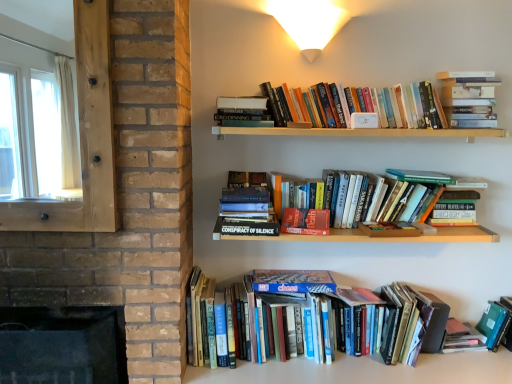
Find the location of a particular element. The image size is (512, 384). hardcover book at center, the third paperback book from the right is located at coordinates (305, 221).

In the scene shown: Measure the distance between green matte folder at lower right, the 1th book when ordered from bottom to top, and camera.

A distance of 6.54 feet exists between green matte folder at lower right, the 1th book when ordered from bottom to top, and camera.

Measure the distance between transparent wooden frame at left and camera.

transparent wooden frame at left and camera are 1.44 meters apart from each other.

Describe the element at coordinates (82, 139) in the screenshot. I see `transparent wooden frame at left` at that location.

What are the coordinates of `dark brick fireplace at lower left` in the screenshot? It's located at (62, 345).

This screenshot has height=384, width=512. In order to click on hardcover book at lower right, placed as the third paperback book when sorted from top to bottom in this screenshot , I will do `click(462, 337)`.

The image size is (512, 384). I want to click on hardcover book at center, which is the 2th paperback book in bottom-to-top order, so click(x=305, y=221).

Is hardcover book at center right, marked as the 1th paperback book in a top-to-bottom arrangement, taller than dark brick fireplace at lower left?

In fact, hardcover book at center right, marked as the 1th paperback book in a top-to-bottom arrangement, may be shorter than dark brick fireplace at lower left.

I want to click on fireplace below the hardcover book at center right, marked as the 1th paperback book in a top-to-bottom arrangement (from the image's perspective), so click(x=62, y=345).

Are hardcover book at center right, which is the 2th paperback book in left-to-right order, and dark brick fireplace at lower left far apart?

Indeed, hardcover book at center right, which is the 2th paperback book in left-to-right order, is not near dark brick fireplace at lower left.

Is point (468, 209) in front of point (70, 307)?

That is True.

Locate an element on the screen. Image resolution: width=512 pixels, height=384 pixels. book that is the 4th object located above the hardcover book at lower right, which ranks as the 3th paperback book in left-to-right order (from the image's perspective) is located at coordinates (243, 112).

Which object is positioned more to the left, hardcover book at lower right, which ranks as the 1th paperback book in right-to-left order, or hardcover book at upper center, positioned as the 2th book in top-to-bottom order?

From the viewer's perspective, hardcover book at upper center, positioned as the 2th book in top-to-bottom order, appears more on the left side.

Which is nearer, (455, 321) or (234, 121)?

The point (234, 121) is more forward.

Is hardcover book at lower right, placed as the third paperback book when sorted from top to bottom, wider than hardcover book at upper center, positioned as the 2th book in top-to-bottom order?

No.

Is hardcover book at upper center, acting as the 4th book starting from the bottom, looking in the opposite direction of hardcover book at center right, which is the 2th paperback book in left-to-right order?

No, hardcover book at center right, which is the 2th paperback book in left-to-right order, is not at the back of hardcover book at upper center, acting as the 4th book starting from the bottom.

From a real-world perspective, is hardcover book at upper center, acting as the 4th book starting from the bottom, over hardcover book at center right, the third paperback book when ordered from bottom to top?

Yes, from a real-world perspective, hardcover book at upper center, acting as the 4th book starting from the bottom, is above hardcover book at center right, the third paperback book when ordered from bottom to top.

Which of these two, hardcover book at upper center, positioned as the 2th book in top-to-bottom order, or hardcover book at center right, the third paperback book when ordered from bottom to top, is bigger?

hardcover book at center right, the third paperback book when ordered from bottom to top.

Can you confirm if hardcover book at center, which is counted as the third book, starting from the top, is bigger than green matte folder at lower right, the 1th book when ordered from bottom to top?

Yes, hardcover book at center, which is counted as the third book, starting from the top, is bigger than green matte folder at lower right, the 1th book when ordered from bottom to top.

From a real-world perspective, between hardcover book at center, which is counted as the third book, starting from the top, and green matte folder at lower right, the 1th book when ordered from bottom to top, who is vertically lower?

green matte folder at lower right, the 1th book when ordered from bottom to top, from a real-world perspective.

Is point (233, 225) positioned in front of point (507, 316)?

That is True.

Is hardcover book at center, which is counted as the third book, starting from the bottom, at the right side of green matte folder at lower right, the 1th book when ordered from bottom to top?

Incorrect, hardcover book at center, which is counted as the third book, starting from the bottom, is not on the right side of green matte folder at lower right, the 1th book when ordered from bottom to top.

How many degrees apart are the facing directions of hardcover book at lower right, which ranks as the 3th paperback book in left-to-right order, and hardcover book at center right, which is the 2th paperback book in left-to-right order?

They differ by 8.31 degrees in their facing directions.

Would you say hardcover book at lower right, which ranks as the 3th paperback book in left-to-right order, is a long distance from hardcover book at center right, the second paperback book when ordered from right to left?

They are positioned close to each other.

Between hardcover book at lower right, which ranks as the 1th paperback book in right-to-left order, and hardcover book at center right, marked as the 1th paperback book in a top-to-bottom arrangement, which one has smaller width?

hardcover book at lower right, which ranks as the 1th paperback book in right-to-left order, is thinner.

Considering the sizes of hardcover book at lower right, which ranks as the 3th paperback book in left-to-right order, and hardcover book at center right, which is the 2th paperback book in left-to-right order, in the image, is hardcover book at lower right, which ranks as the 3th paperback book in left-to-right order, taller or shorter than hardcover book at center right, which is the 2th paperback book in left-to-right order,?

Clearly, hardcover book at lower right, which ranks as the 3th paperback book in left-to-right order, is shorter compared to hardcover book at center right, which is the 2th paperback book in left-to-right order.

Measure the distance from hardcover books at lower center, the fourth book in the top-to-bottom sequence, to dark brick fireplace at lower left.

A distance of 26.15 inches exists between hardcover books at lower center, the fourth book in the top-to-bottom sequence, and dark brick fireplace at lower left.

Starting from the dark brick fireplace at lower left, which book is the 3rd one behind? Please provide its 2D coordinates.

[(310, 322)]

Considering the sizes of objects hardcover books at lower center, the 2th book when ordered from bottom to top, and dark brick fireplace at lower left in the image provided, who is taller, hardcover books at lower center, the 2th book when ordered from bottom to top, or dark brick fireplace at lower left?

dark brick fireplace at lower left.

Is hardcover books at lower center, the fourth book in the top-to-bottom sequence, turned away from dark brick fireplace at lower left?

hardcover books at lower center, the fourth book in the top-to-bottom sequence, is not turned away from dark brick fireplace at lower left.

Can you confirm if transparent wooden frame at left is thinner than hardcover book at center, which is counted as the third book, starting from the top?

Correct, the width of transparent wooden frame at left is less than that of hardcover book at center, which is counted as the third book, starting from the top.

Which of these two, transparent wooden frame at left or hardcover book at center, which is counted as the third book, starting from the bottom, is smaller?

Smaller between the two is hardcover book at center, which is counted as the third book, starting from the bottom.

From a real-world perspective, who is located lower, transparent wooden frame at left or hardcover book at center, which is counted as the third book, starting from the top?

In real-world perspective, hardcover book at center, which is counted as the third book, starting from the top, is lower.

Which is closer to the camera, (15, 211) or (256, 217)?

The point (15, 211) is in front.

The height and width of the screenshot is (384, 512). Find the location of `fireplace below the hardcover book at center right, the second paperback book when ordered from right to left (from a real-world perspective)`. fireplace below the hardcover book at center right, the second paperback book when ordered from right to left (from a real-world perspective) is located at coordinates (62, 345).

Find the location of a particular element. the 4th book above when counting from the hardcover book at lower right, which ranks as the 1th paperback book in right-to-left order (from the image's perspective) is located at coordinates (243, 112).

Considering their positions, is hardcover book at upper center, positioned as the 2th book in top-to-bottom order, positioned further to hardcover book at center right, which is the 2th paperback book in left-to-right order, than hardcover books at lower center, the fourth book in the top-to-bottom sequence?

hardcover book at upper center, positioned as the 2th book in top-to-bottom order.

Based on their spatial positions, is hardcover books at lower center, the 2th book when ordered from bottom to top, or green matte folder at lower right, which is the fifth book from top to bottom, closer to transparent wooden frame at left?

The object closer to transparent wooden frame at left is hardcover books at lower center, the 2th book when ordered from bottom to top.

From the image, which object appears to be farther from hardcover book at lower right, which appears as the 1th paperback book when ordered from the bottom, hardcover book at center, which is counted as the third book, starting from the top, or hardcover books at upper right, the first book from the top?

hardcover book at center, which is counted as the third book, starting from the top.

Based on their spatial positions, is hardcover books at lower center, the 2th book when ordered from bottom to top, or dark brick fireplace at lower left closer to hardcover book at center right, which is the 2th paperback book in left-to-right order?

The object closer to hardcover book at center right, which is the 2th paperback book in left-to-right order, is hardcover books at lower center, the 2th book when ordered from bottom to top.

Considering their positions, is hardcover book at center, the third paperback book from the right, positioned further to hardcover book at center, which is counted as the third book, starting from the bottom, than transparent wooden frame at left?

transparent wooden frame at left lies further to hardcover book at center, which is counted as the third book, starting from the bottom, than the other object.

Which object lies nearer to the anchor point transparent wooden frame at left, hardcover book at upper center, positioned as the 2th book in top-to-bottom order, or hardcover books at upper right, the 5th book positioned from the bottom?

The object closer to transparent wooden frame at left is hardcover book at upper center, positioned as the 2th book in top-to-bottom order.

Estimate the real-world distances between objects in this image. Which object is further from white matte wall sconce at upper center, hardcover books at lower center, the 2th book when ordered from bottom to top, or dark brick fireplace at lower left?

dark brick fireplace at lower left lies further to white matte wall sconce at upper center than the other object.

Which object lies further to the anchor point green matte folder at lower right, the 1th book when ordered from bottom to top, transparent wooden frame at left or hardcover books at lower center, the fourth book in the top-to-bottom sequence?

transparent wooden frame at left is further to green matte folder at lower right, the 1th book when ordered from bottom to top.

Where is `paperback book situated between transparent wooden frame at left and white matte wall sconce at upper center from left to right`? This screenshot has height=384, width=512. paperback book situated between transparent wooden frame at left and white matte wall sconce at upper center from left to right is located at coordinates (305, 221).

Locate an element on the screen. The height and width of the screenshot is (384, 512). light fixture between transparent wooden frame at left and hardcover book at center right, the second paperback book when ordered from right to left, in the horizontal direction is located at coordinates pyautogui.click(x=309, y=22).

I want to click on light fixture located between transparent wooden frame at left and green matte folder at lower right, the 1th book when ordered from bottom to top, in the left-right direction, so click(309, 22).

Where is `light fixture between dark brick fireplace at lower left and green matte folder at lower right, which is the fifth book from top to bottom`? Image resolution: width=512 pixels, height=384 pixels. light fixture between dark brick fireplace at lower left and green matte folder at lower right, which is the fifth book from top to bottom is located at coordinates (309, 22).